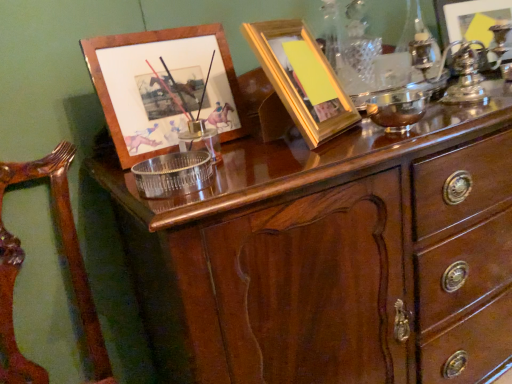
Question: Is wooden picture frame at upper left, placed as the 2th picture frame when sorted from front to back, closer to camera compared to wooden armchair at left?

Choices:
 (A) no
 (B) yes

Answer: (A)

Question: Can you confirm if wooden picture frame at upper left, which appears as the third picture frame when viewed from the right, is smaller than wooden armchair at left?

Choices:
 (A) no
 (B) yes

Answer: (B)

Question: Is wooden armchair at left at the back of wooden picture frame at upper left, positioned as the 1th picture frame in left-to-right order?

Choices:
 (A) no
 (B) yes

Answer: (A)

Question: Can you confirm if wooden picture frame at upper left, which appears as the 2th picture frame when viewed from the back, is taller than wooden armchair at left?

Choices:
 (A) no
 (B) yes

Answer: (A)

Question: Is wooden picture frame at upper left, positioned as the 1th picture frame in left-to-right order, next to wooden armchair at left?

Choices:
 (A) no
 (B) yes

Answer: (A)

Question: Considering the positions of mahogany wood chest of drawers at upper center and wooden armchair at left in the image, is mahogany wood chest of drawers at upper center taller or shorter than wooden armchair at left?

Choices:
 (A) tall
 (B) short

Answer: (A)

Question: In terms of size, does mahogany wood chest of drawers at upper center appear bigger or smaller than wooden armchair at left?

Choices:
 (A) big
 (B) small

Answer: (A)

Question: From a real-world perspective, relative to wooden armchair at left, is mahogany wood chest of drawers at upper center vertically above or below?

Choices:
 (A) above
 (B) below

Answer: (B)

Question: Is mahogany wood chest of drawers at upper center in front of or behind wooden armchair at left in the image?

Choices:
 (A) front
 (B) behind

Answer: (B)

Question: Looking at the image, does mahogany wood chest of drawers at upper center seem bigger or smaller compared to yellow matte picture frame at upper center, which is the 3th picture frame from back to front?

Choices:
 (A) small
 (B) big

Answer: (B)

Question: Is mahogany wood chest of drawers at upper center wider or thinner than yellow matte picture frame at upper center, the 1th picture frame when ordered from front to back?

Choices:
 (A) wide
 (B) thin

Answer: (A)

Question: In terms of height, does mahogany wood chest of drawers at upper center look taller or shorter compared to yellow matte picture frame at upper center, the 1th picture frame when ordered from front to back?

Choices:
 (A) short
 (B) tall

Answer: (B)

Question: Does point (257, 188) appear closer or farther from the camera than point (282, 29)?

Choices:
 (A) closer
 (B) farther

Answer: (A)

Question: Is metallic silver picture frame at upper right, the 1th picture frame viewed from the right, wider or thinner than mahogany wood chest of drawers at upper center?

Choices:
 (A) thin
 (B) wide

Answer: (A)

Question: Is metallic silver picture frame at upper right, acting as the 3th picture frame starting from the left, spatially inside mahogany wood chest of drawers at upper center, or outside of it?

Choices:
 (A) outside
 (B) inside

Answer: (A)